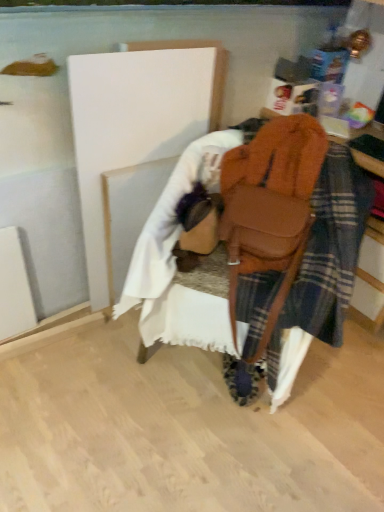
Question: Is white painted wood at center, positioned as the first wood in top-to-bottom order, positioned with its back to brown leather bag at center?

Choices:
 (A) no
 (B) yes

Answer: (A)

Question: Does white painted wood at center, positioned as the first wood in top-to-bottom order, have a greater height compared to brown leather bag at center?

Choices:
 (A) yes
 (B) no

Answer: (A)

Question: Are white painted wood at center, positioned as the first wood in top-to-bottom order, and brown leather bag at center located far from each other?

Choices:
 (A) yes
 (B) no

Answer: (B)

Question: Is white painted wood at center, acting as the second wood starting from the bottom, completely or partially outside of brown leather bag at center?

Choices:
 (A) yes
 (B) no

Answer: (A)

Question: Considering the relative sizes of white painted wood at center, positioned as the first wood in top-to-bottom order, and brown leather bag at center in the image provided, is white painted wood at center, positioned as the first wood in top-to-bottom order, smaller than brown leather bag at center?

Choices:
 (A) yes
 (B) no

Answer: (B)

Question: Can you confirm if white painted wood at center, acting as the second wood starting from the bottom, is shorter than brown leather bag at center?

Choices:
 (A) yes
 (B) no

Answer: (B)

Question: Is brown leather bag at center located outside white fabric at lower center, marked as the second wood in a top-to-bottom arrangement?

Choices:
 (A) yes
 (B) no

Answer: (A)

Question: Is brown leather bag at center to the right of white fabric at lower center, marked as the second wood in a top-to-bottom arrangement, from the viewer's perspective?

Choices:
 (A) yes
 (B) no

Answer: (A)

Question: Is brown leather bag at center not near white fabric at lower center, which appears as the first wood when ordered from the bottom?

Choices:
 (A) no
 (B) yes

Answer: (A)

Question: From a real-world perspective, is brown leather bag at center on white fabric at lower center, marked as the second wood in a top-to-bottom arrangement?

Choices:
 (A) yes
 (B) no

Answer: (A)

Question: Are brown leather bag at center and white fabric at lower center, marked as the second wood in a top-to-bottom arrangement, beside each other?

Choices:
 (A) yes
 (B) no

Answer: (B)

Question: Could you tell me if brown leather bag at center is facing white fabric at lower center, which appears as the first wood when ordered from the bottom?

Choices:
 (A) yes
 (B) no

Answer: (B)

Question: Can you confirm if white painted wood at center, positioned as the first wood in top-to-bottom order, is smaller than white fabric at lower center, marked as the second wood in a top-to-bottom arrangement?

Choices:
 (A) yes
 (B) no

Answer: (B)